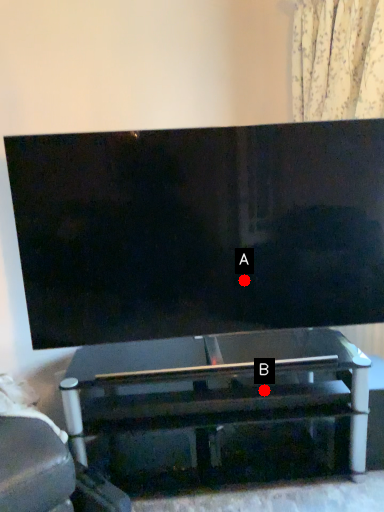
Question: Two points are circled on the image, labeled by A and B beside each circle. Which point appears farthest from the camera in this image?

Choices:
 (A) A is further
 (B) B is further

Answer: (A)